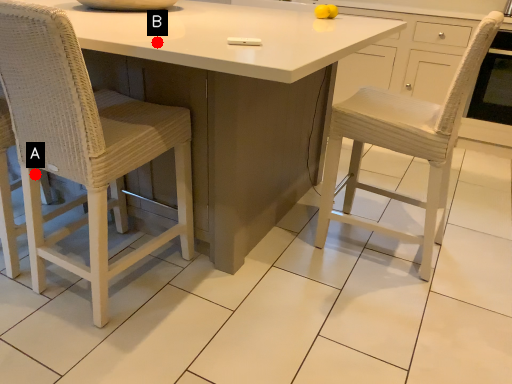
Question: Two points are circled on the image, labeled by A and B beside each circle. Which point is further to the camera?

Choices:
 (A) A is further
 (B) B is further

Answer: (A)